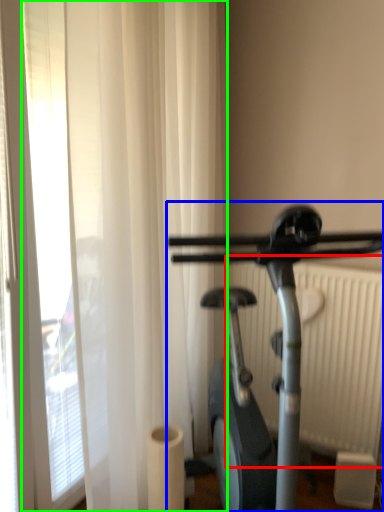
Question: Based on their relative distances, which object is farther from radiator (highlighted by a red box)? Choose from stationary bicycle (highlighted by a blue box) and shower curtain (highlighted by a green box).

Choices:
 (A) stationary bicycle
 (B) shower curtain

Answer: (A)